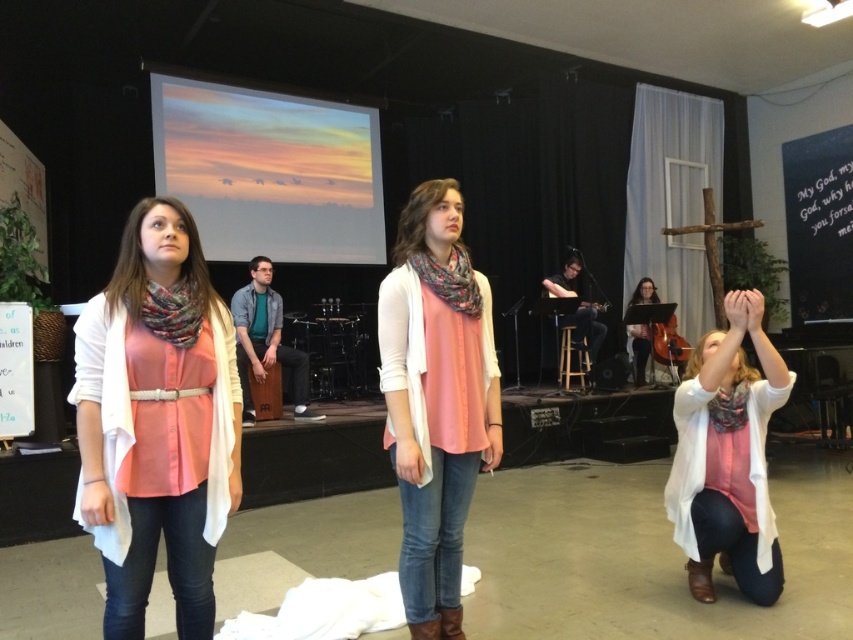
Between matte coral blouse at center and matte black cello at center, which one has more height?

Standing taller between the two is matte coral blouse at center.

Does point (201, 376) come in front of point (640, 342)?

Yes, point (201, 376) is in front of point (640, 342).

You are a GUI agent. You are given a task and a screenshot of the screen. Output one action in this format:
    pyautogui.click(x=<x>, y=<y>)
    Task: Click on the matte coral blouse at center
    
    Given the screenshot: What is the action you would take?
    (x=157, y=420)

Is matte coral blouse at center bigger than multicolored knit scarf at center?

Yes.

Image resolution: width=853 pixels, height=640 pixels. Describe the element at coordinates (157, 420) in the screenshot. I see `matte coral blouse at center` at that location.

Where is `matte coral blouse at center`? matte coral blouse at center is located at coordinates (157, 420).

Consider the image. Does printed silk scarf at left have a greater height compared to multicolored knit scarf at center?

Incorrect, printed silk scarf at left's height is not larger of multicolored knit scarf at center's.

Does printed silk scarf at left have a greater width compared to multicolored knit scarf at center?

In fact, printed silk scarf at left might be narrower than multicolored knit scarf at center.

Is point (173, 324) more distant than point (431, 278)?

That is False.

Where is `printed silk scarf at left`? printed silk scarf at left is located at coordinates (173, 310).